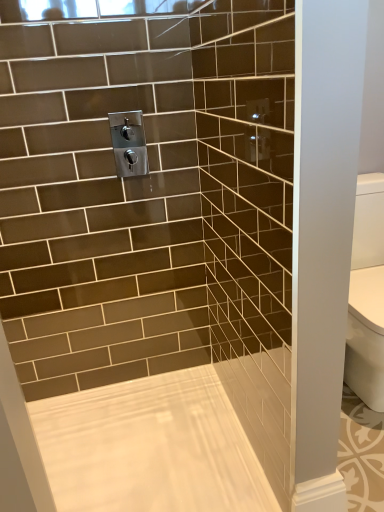
Describe the element at coordinates (173, 440) in the screenshot. I see `white glossy bathtub at center` at that location.

What is the approximate height of white glossy bathtub at center?

The height of white glossy bathtub at center is 1.09 inches.

Where is `white glossy bathtub at center`? white glossy bathtub at center is located at coordinates (173, 440).

Measure the distance between point (x=148, y=164) and camera.

Point (x=148, y=164) and camera are 1.55 meters apart.

The height and width of the screenshot is (512, 384). What do you see at coordinates (129, 143) in the screenshot? I see `satin nickel faucet at upper center` at bounding box center [129, 143].

Find the location of `satin nickel faucet at upper center`. satin nickel faucet at upper center is located at coordinates (129, 143).

Where is `white glossy bathtub at center`? This screenshot has width=384, height=512. white glossy bathtub at center is located at coordinates (173, 440).

Which is more to the left, satin nickel faucet at upper center or white glossy bathtub at center?

Positioned to the left is satin nickel faucet at upper center.

From the picture: Is the depth of satin nickel faucet at upper center less than that of white glossy bathtub at center?

No, satin nickel faucet at upper center is behind white glossy bathtub at center.

Is point (143, 165) less distant than point (117, 440)?

Yes.

In the scene shown: From the image's perspective, which is below, satin nickel faucet at upper center or white glossy bathtub at center?

white glossy bathtub at center.

From a real-world perspective, is satin nickel faucet at upper center over white glossy bathtub at center?

Yes, from a real-world perspective, satin nickel faucet at upper center is over white glossy bathtub at center

Which of these two, satin nickel faucet at upper center or white glossy bathtub at center, is thinner?

Thinner between the two is satin nickel faucet at upper center.

Considering the relative sizes of satin nickel faucet at upper center and white glossy bathtub at center in the image provided, is satin nickel faucet at upper center taller than white glossy bathtub at center?

Yes, satin nickel faucet at upper center is taller than white glossy bathtub at center.

Based on their sizes in the image, would you say satin nickel faucet at upper center is bigger or smaller than white glossy bathtub at center?

Considering their sizes, satin nickel faucet at upper center takes up less space than white glossy bathtub at center.

Is satin nickel faucet at upper center situated inside white glossy bathtub at center or outside?

satin nickel faucet at upper center is outside white glossy bathtub at center.

Is satin nickel faucet at upper center in contact with white glossy bathtub at center?

No, satin nickel faucet at upper center is not touching white glossy bathtub at center.

Does satin nickel faucet at upper center turn towards white glossy bathtub at center?

No, satin nickel faucet at upper center is not facing towards white glossy bathtub at center.

How many degrees apart are the facing directions of satin nickel faucet at upper center and white glossy bathtub at center?

The angular difference between satin nickel faucet at upper center and white glossy bathtub at center is 90.2 degrees.

How much distance is there between satin nickel faucet at upper center and white glossy bathtub at center?

A distance of 37.93 inches exists between satin nickel faucet at upper center and white glossy bathtub at center.

Locate an element on the screen. The height and width of the screenshot is (512, 384). plumbing fixture that is on the left side of white glossy bathtub at center is located at coordinates (129, 143).

Is white glossy bathtub at center to the right of satin nickel faucet at upper center from the viewer's perspective?

Yes, white glossy bathtub at center is to the right of satin nickel faucet at upper center.

Which is behind, white glossy bathtub at center or satin nickel faucet at upper center?

satin nickel faucet at upper center is behind.

Between point (85, 435) and point (143, 166), which one is positioned behind?

The point (85, 435) is behind.

From the image's perspective, between white glossy bathtub at center and satin nickel faucet at upper center, which one is located above?

satin nickel faucet at upper center.

From a real-world perspective, which is physically above, white glossy bathtub at center or satin nickel faucet at upper center?

In real-world perspective, satin nickel faucet at upper center is above.

Can you confirm if white glossy bathtub at center is thinner than satin nickel faucet at upper center?

No, white glossy bathtub at center is not thinner than satin nickel faucet at upper center.

Who is shorter, white glossy bathtub at center or satin nickel faucet at upper center?

Standing shorter between the two is white glossy bathtub at center.

Between white glossy bathtub at center and satin nickel faucet at upper center, which one has smaller size?

With smaller size is satin nickel faucet at upper center.

Do you think white glossy bathtub at center is within satin nickel faucet at upper center, or outside of it?

white glossy bathtub at center lies outside satin nickel faucet at upper center.

Is there a large distance between white glossy bathtub at center and satin nickel faucet at upper center?

No, there isn't a large distance between white glossy bathtub at center and satin nickel faucet at upper center.

Is white glossy bathtub at center turned away from satin nickel faucet at upper center?

white glossy bathtub at center does not have its back to satin nickel faucet at upper center.

What's the angular difference between white glossy bathtub at center and satin nickel faucet at upper center's facing directions?

They differ by 90.2 degrees in their facing directions.

Based on the photo, how much distance is there between white glossy bathtub at center and satin nickel faucet at upper center?

white glossy bathtub at center and satin nickel faucet at upper center are 37.93 inches apart from each other.

Image resolution: width=384 pixels, height=512 pixels. In order to click on plumbing fixture above the white glossy bathtub at center (from a real-world perspective) in this screenshot , I will do `click(129, 143)`.

I want to click on plumbing fixture lying above the white glossy bathtub at center (from the image's perspective), so click(129, 143).

I want to click on bath below the satin nickel faucet at upper center (from the image's perspective), so click(x=173, y=440).